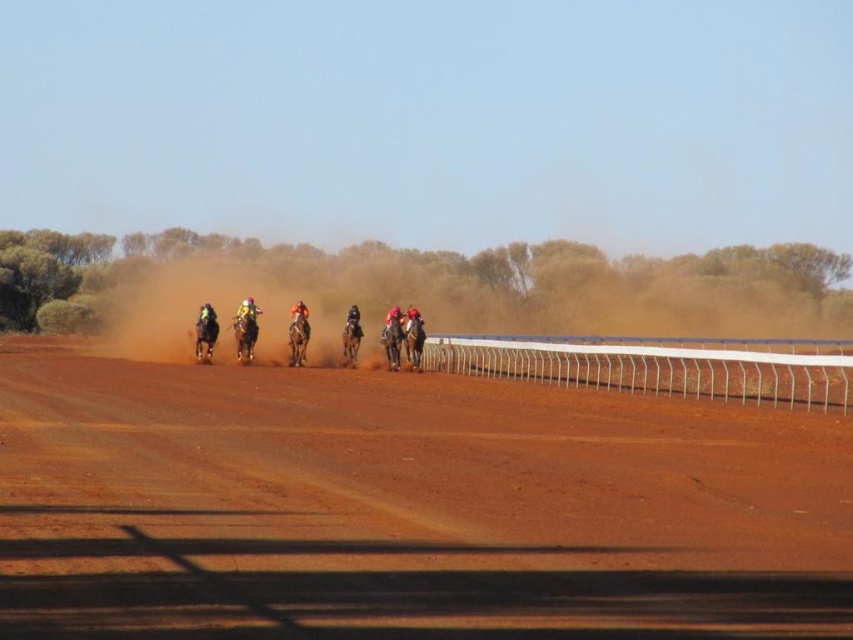
Question: Is dusty reddish-brown dirt track at center smaller than orange fabric rider at center?

Choices:
 (A) yes
 (B) no

Answer: (B)

Question: Does dusty reddish-brown dirt track at center appear on the right side of orange fabric rider at center?

Choices:
 (A) no
 (B) yes

Answer: (B)

Question: Which of the following is the closest to the observer?

Choices:
 (A) (289, 328)
 (B) (347, 576)

Answer: (B)

Question: Which point is closer to the camera taking this photo?

Choices:
 (A) (306, 314)
 (B) (532, 529)

Answer: (B)

Question: Is dusty reddish-brown dirt track at center above orange fabric rider at center?

Choices:
 (A) yes
 (B) no

Answer: (B)